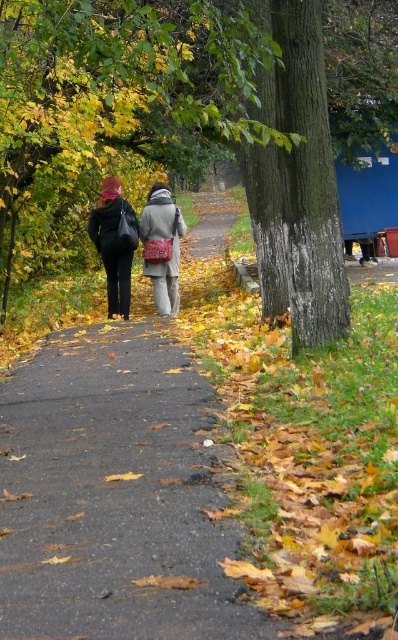
You are standing at the starting point of the path in the park scene. There are two points marked on the path ahead of you. The first point is at coordinate point (120, 243) and the second point is at coordinate point (148, 220). If you walk towards the two points, which point will you reach first?

Point (120, 243) is in front of point (148, 220), so you will reach point (120, 243) first.

You are standing on the path and see two people walking away from you. They are wearing matte black coat at center and matte gray coat at center. Which one is positioned to the left?

The matte black coat at center is positioned to the left of the matte gray coat at center.